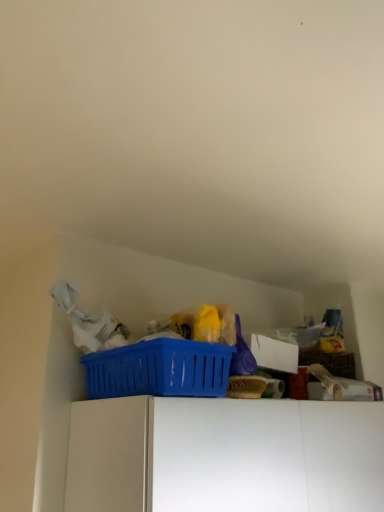
Where is `white matte cabinet at upper center`? white matte cabinet at upper center is located at coordinates (225, 455).

What do you see at coordinates (225, 455) in the screenshot?
I see `white matte cabinet at upper center` at bounding box center [225, 455].

You are a GUI agent. You are given a task and a screenshot of the screen. Output one action in this format:
    pyautogui.click(x=<x>, y=<y>)
    Task: Click on the blue plastic basket at upper center
    
    Given the screenshot: What is the action you would take?
    pyautogui.click(x=159, y=369)

The image size is (384, 512). Describe the element at coordinates (159, 369) in the screenshot. I see `blue plastic basket at upper center` at that location.

Measure the distance between point (x=186, y=394) and camera.

Point (x=186, y=394) and camera are 30.71 inches apart from each other.

Image resolution: width=384 pixels, height=512 pixels. I want to click on white matte cabinet at upper center, so click(x=225, y=455).

Considering the positions of objects white matte cabinet at upper center and blue plastic basket at upper center in the image provided, who is more to the right, white matte cabinet at upper center or blue plastic basket at upper center?

white matte cabinet at upper center is more to the right.

Looking at this image, which object is more forward, white matte cabinet at upper center or blue plastic basket at upper center?

white matte cabinet at upper center is closer to the camera.

Is point (287, 468) farther from viewer compared to point (214, 364)?

That is True.

From the image's perspective, which is above, white matte cabinet at upper center or blue plastic basket at upper center?

blue plastic basket at upper center, from the image's perspective.

From a real-world perspective, is white matte cabinet at upper center under blue plastic basket at upper center?

Yes, from a real-world perspective, white matte cabinet at upper center is under blue plastic basket at upper center.

Is white matte cabinet at upper center thinner than blue plastic basket at upper center?

Incorrect, the width of white matte cabinet at upper center is not less than that of blue plastic basket at upper center.

In terms of height, does white matte cabinet at upper center look taller or shorter compared to blue plastic basket at upper center?

white matte cabinet at upper center is taller than blue plastic basket at upper center.

Who is smaller, white matte cabinet at upper center or blue plastic basket at upper center?

blue plastic basket at upper center is smaller.

Would you say blue plastic basket at upper center is part of white matte cabinet at upper center's contents?

No, white matte cabinet at upper center does not contain blue plastic basket at upper center.

Is white matte cabinet at upper center directly adjacent to blue plastic basket at upper center?

white matte cabinet at upper center is not next to blue plastic basket at upper center, and they're not touching.

Is white matte cabinet at upper center facing away from blue plastic basket at upper center?

That's not correct — white matte cabinet at upper center is not looking away from blue plastic basket at upper center.

How much distance is there between white matte cabinet at upper center and blue plastic basket at upper center?

They are 5.71 inches apart.

Find the location of a particular element. basket behind the white matte cabinet at upper center is located at coordinates click(159, 369).

Considering the positions of objects blue plastic basket at upper center and white matte cabinet at upper center in the image provided, who is more to the left, blue plastic basket at upper center or white matte cabinet at upper center?

Positioned to the left is blue plastic basket at upper center.

Relative to white matte cabinet at upper center, is blue plastic basket at upper center in front or behind?

Clearly, blue plastic basket at upper center is behind white matte cabinet at upper center.

Considering the points (207, 362) and (81, 501), which point is in front, point (207, 362) or point (81, 501)?

The point (207, 362) is in front.

From the image's perspective, is blue plastic basket at upper center beneath white matte cabinet at upper center?

Actually, blue plastic basket at upper center appears above white matte cabinet at upper center in the image.

From a real-world perspective, is blue plastic basket at upper center positioned over white matte cabinet at upper center based on gravity?

Yes, from a real-world perspective, blue plastic basket at upper center is on top of white matte cabinet at upper center.

Can you confirm if blue plastic basket at upper center is thinner than white matte cabinet at upper center?

Yes.

Between blue plastic basket at upper center and white matte cabinet at upper center, which one has less height?

Standing shorter between the two is blue plastic basket at upper center.

Looking at the image, does blue plastic basket at upper center seem bigger or smaller compared to white matte cabinet at upper center?

blue plastic basket at upper center is smaller than white matte cabinet at upper center.

Is blue plastic basket at upper center outside of white matte cabinet at upper center?

Yes, blue plastic basket at upper center is not within white matte cabinet at upper center.

Is blue plastic basket at upper center far away from white matte cabinet at upper center?

No.

Is blue plastic basket at upper center facing away from white matte cabinet at upper center?

blue plastic basket at upper center is not turned away from white matte cabinet at upper center.

How many degrees apart are the facing directions of blue plastic basket at upper center and white matte cabinet at upper center?

The facing directions of blue plastic basket at upper center and white matte cabinet at upper center are 1.8 degrees apart.

How far apart are blue plastic basket at upper center and white matte cabinet at upper center?

5.71 inches.

Where is `furniture that is in front of the blue plastic basket at upper center`? The image size is (384, 512). furniture that is in front of the blue plastic basket at upper center is located at coordinates (225, 455).

Find the location of a particular element. This screenshot has height=512, width=384. basket that appears above the white matte cabinet at upper center (from the image's perspective) is located at coordinates point(159,369).

I want to click on basket lying behind the white matte cabinet at upper center, so [159, 369].